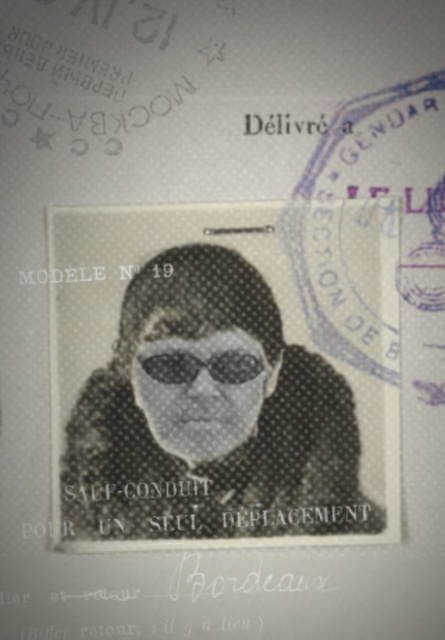
Does black textured hair at center appear under black matte goggles at center?

Indeed, black textured hair at center is positioned under black matte goggles at center.

Between black textured hair at center and black matte goggles at center, which one has less height?

black matte goggles at center

Who is more forward, (292,442) or (146,371)?

Point (292,442) is in front.

This screenshot has width=445, height=640. Identify the location of black textured hair at center. (210, 417).